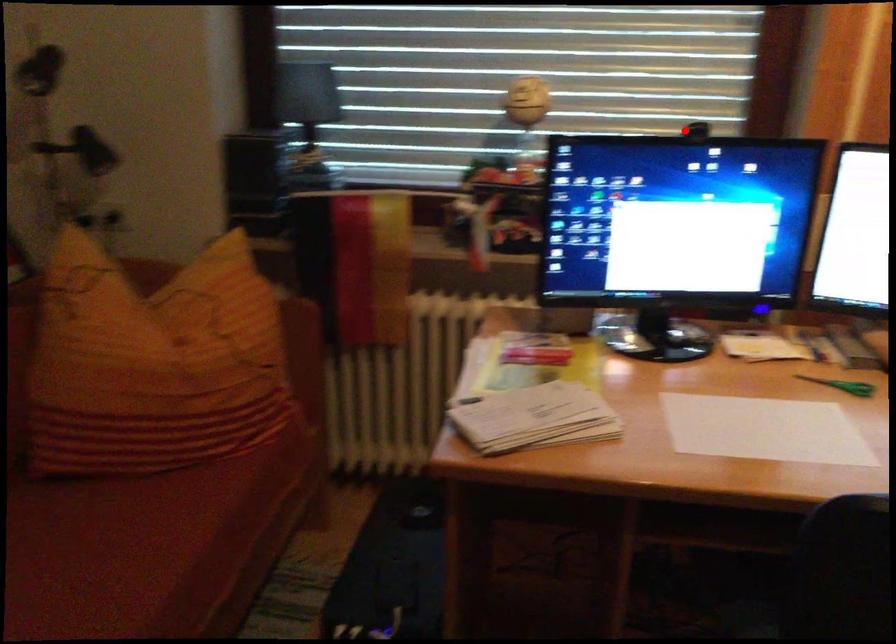
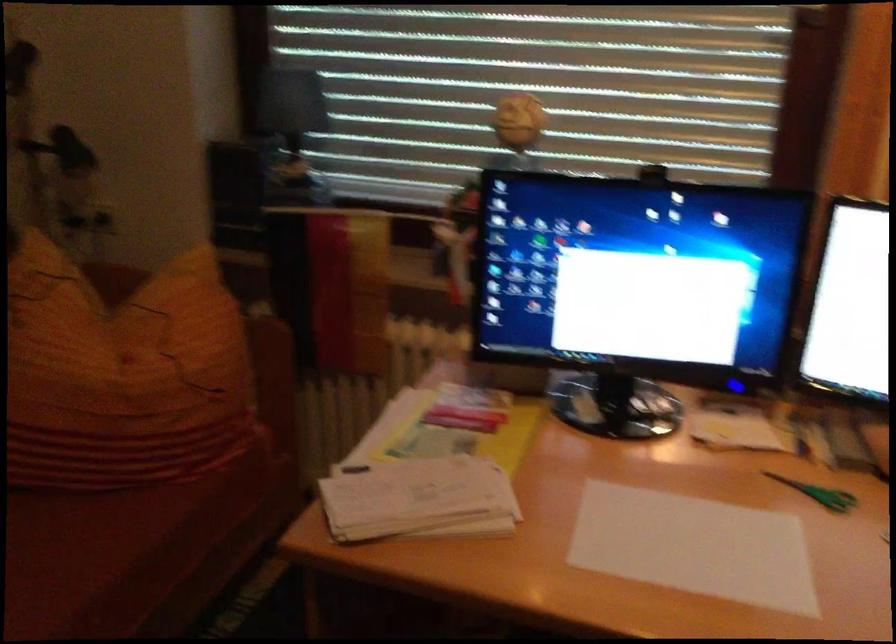
Question: I am providing you with two images of the same scene from different viewpoints. In image1, a red point is highlighted. Considering the same 3D point in image2, which of the following is correct?

Choices:
 (A) It is closer
 (B) It is farther

Answer: (A)